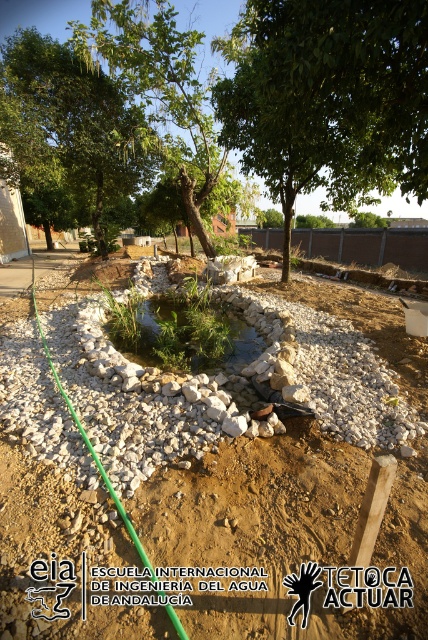
You are standing in the construction area and want to walk from the green leafy tree at upper center to the green grassy pond at center. Which direction should you move to get closer to the pond?

You should move away from the green leafy tree at upper center towards the green grassy pond at center since the tree is closer to you than the pond.

You are a surveyor standing at the edge of the pond and need to determine the distance between the two points marked as point (189, 80) and point (189, 360). Given that both points are at the same height, which point is closer to you?

Point (189, 80) is closer to you because it is further to the viewer than point (189, 360), meaning it is positioned nearer in the scene.

You are designing a garden layout and need to place a new decorative statue that requires a 3 meter wide space. Given the white gravel pond at center and the green leafy tree at upper left, which object has enough space to accommodate the statue?

The green leafy tree at upper left has a greater width than the white gravel pond at center, so the statue can be placed near the green leafy tree at upper left as it provides sufficient space.